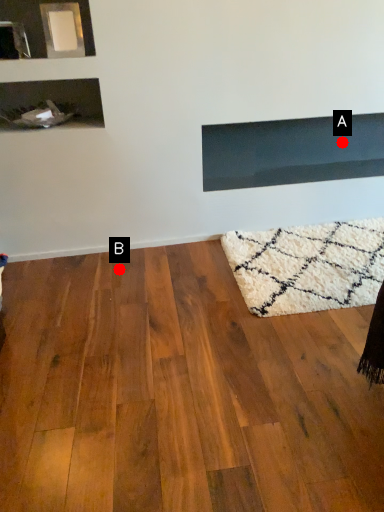
Question: Two points are circled on the image, labeled by A and B beside each circle. Which point is closer to the camera?

Choices:
 (A) A is closer
 (B) B is closer

Answer: (B)